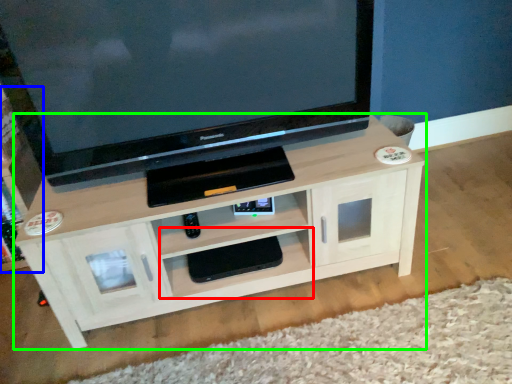
Question: Which object is positioned farthest from shelf (highlighted by a red box)? Select from tv cabinet (highlighted by a blue box) and shelf (highlighted by a green box).

Choices:
 (A) tv cabinet
 (B) shelf

Answer: (A)